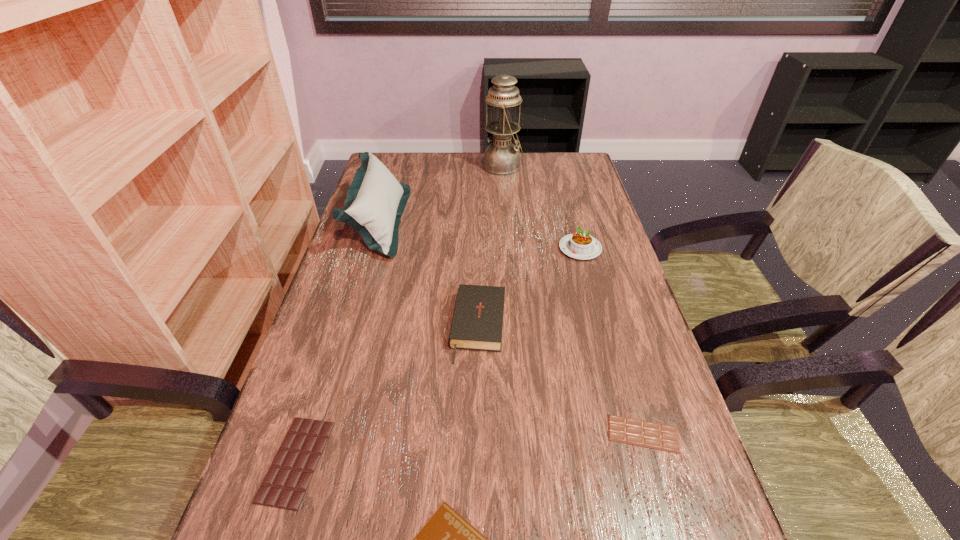
The height and width of the screenshot is (540, 960). Identify the location of chocolate bar present at the right edge. (647, 434).

Find the location of a particular element. This screenshot has height=540, width=960. free space at the far edge of the desktop is located at coordinates (481, 180).

The height and width of the screenshot is (540, 960). In order to click on free space at the left edge of the desktop in this screenshot , I will do `click(329, 370)`.

The width and height of the screenshot is (960, 540). In order to click on vacant space at the right edge in this screenshot , I will do `click(598, 369)`.

Find the location of a particular element. The width and height of the screenshot is (960, 540). free space at the far left corner of the desktop is located at coordinates (408, 159).

The height and width of the screenshot is (540, 960). I want to click on vacant space at the far right corner, so click(555, 170).

Where is `vacant area between the Bible and the farthest object`? Image resolution: width=960 pixels, height=540 pixels. vacant area between the Bible and the farthest object is located at coordinates (491, 247).

Where is `free space between the rightmost chocolate bar and the tallest chocolate bar`? Image resolution: width=960 pixels, height=540 pixels. free space between the rightmost chocolate bar and the tallest chocolate bar is located at coordinates (469, 447).

Where is `empty space between the tallest object and the third tallest object`? The height and width of the screenshot is (540, 960). empty space between the tallest object and the third tallest object is located at coordinates (541, 207).

Where is `vacant area that lies between the tallest chocolate bar and the farthest object`? This screenshot has width=960, height=540. vacant area that lies between the tallest chocolate bar and the farthest object is located at coordinates (399, 314).